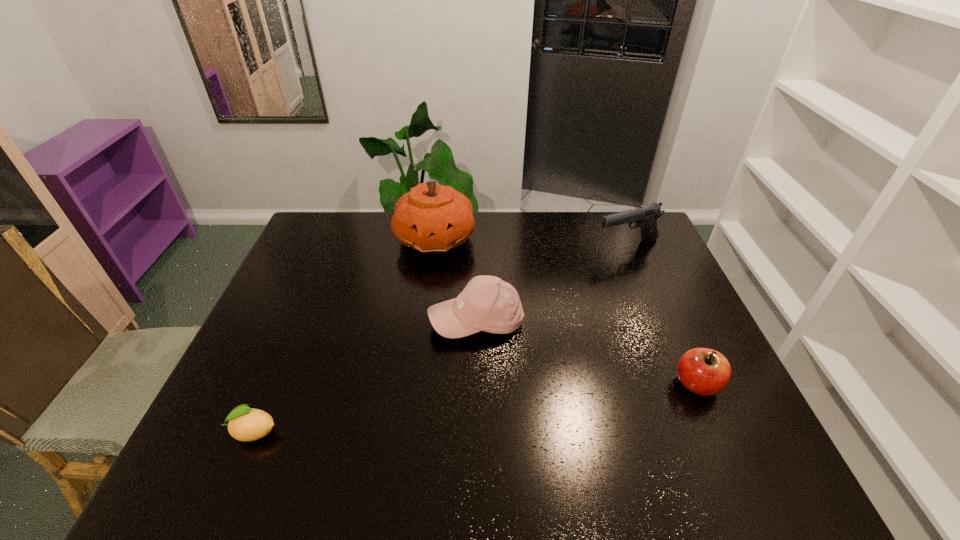
Image resolution: width=960 pixels, height=540 pixels. What are the coordinates of `vacant space in between the second nearest object and the baseball cap` in the screenshot? It's located at (587, 352).

I want to click on free space that is in between the lemon and the apple, so click(x=475, y=408).

Identify the location of free point between the pumpkin and the gun. (532, 242).

This screenshot has width=960, height=540. Find the location of `vacant area that lies between the gun and the lemon`. vacant area that lies between the gun and the lemon is located at coordinates (441, 339).

Locate an element on the screen. The height and width of the screenshot is (540, 960). object identified as the second closest to the gun is located at coordinates (431, 218).

In order to click on object that stands as the fourth closest to the shortest object in this screenshot , I will do `click(645, 217)`.

Image resolution: width=960 pixels, height=540 pixels. Find the location of `free location that satisfies the following two spatial constraints: 1. on the front side of the pumpkin; 2. on the right side of the apple`. free location that satisfies the following two spatial constraints: 1. on the front side of the pumpkin; 2. on the right side of the apple is located at coordinates (417, 384).

You are a GUI agent. You are given a task and a screenshot of the screen. Output one action in this format:
    pyautogui.click(x=<x>, y=<y>)
    Task: Click on the free space that satisfies the following two spatial constraints: 1. on the front side of the gun; 2. on the left side of the tallest object
    
    Given the screenshot: What is the action you would take?
    pyautogui.click(x=435, y=247)

Where is `vacant space that satisfies the following two spatial constraints: 1. on the front side of the gun; 2. on the left side of the pumpkin`? vacant space that satisfies the following two spatial constraints: 1. on the front side of the gun; 2. on the left side of the pumpkin is located at coordinates (435, 247).